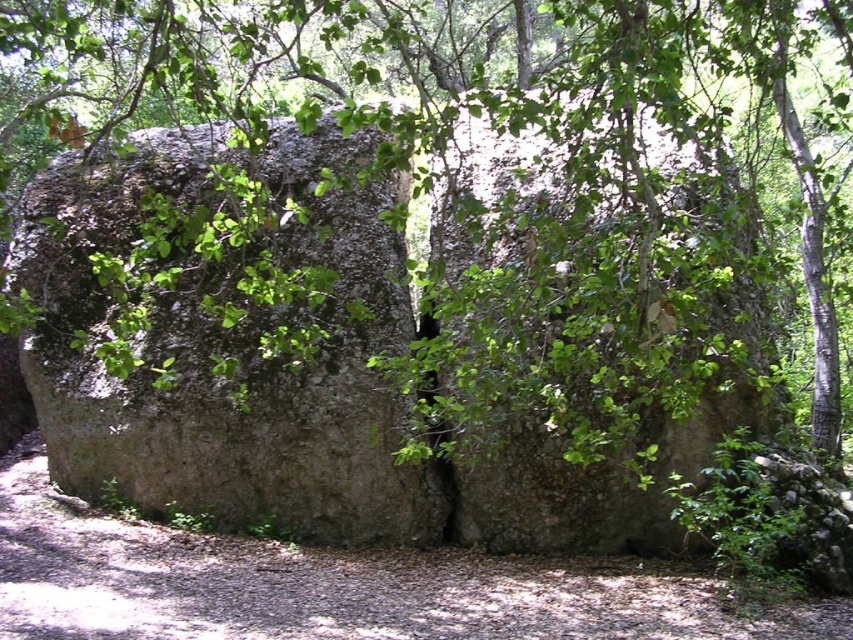
Question: Which object is closer to the camera taking this photo?

Choices:
 (A) green leafy tree at center
 (B) brown gravel trail at lower center

Answer: (B)

Question: Where is green leafy tree at center located in relation to brown gravel trail at lower center in the image?

Choices:
 (A) right
 (B) left

Answer: (A)

Question: Can you confirm if green leafy tree at center is wider than brown gravel trail at lower center?

Choices:
 (A) no
 (B) yes

Answer: (A)

Question: Does green leafy tree at center have a greater width compared to brown gravel trail at lower center?

Choices:
 (A) yes
 (B) no

Answer: (B)